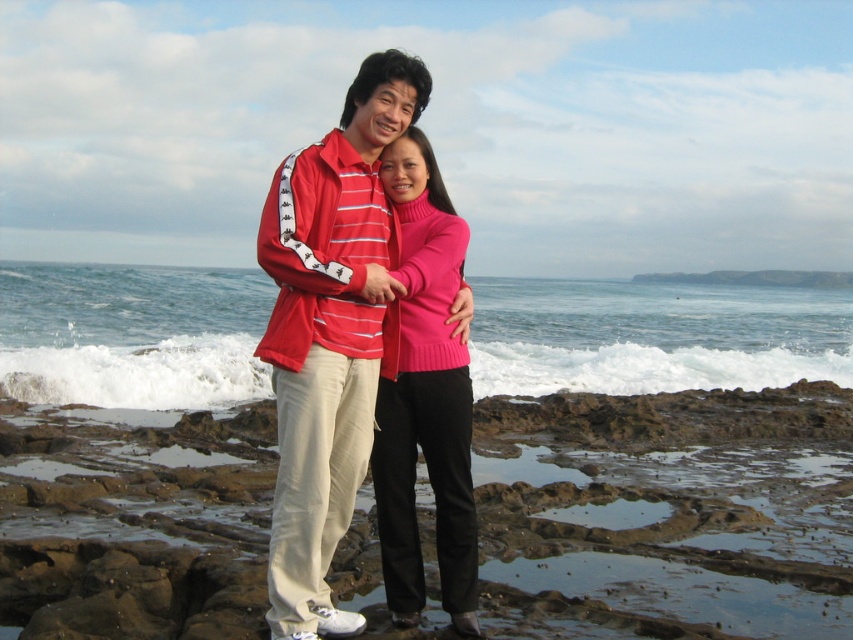
Question: Can you confirm if matte red jacket at center is positioned below matte pink sweater at center?

Choices:
 (A) no
 (B) yes

Answer: (A)

Question: Estimate the real-world distances between objects in this image. Which object is closer to the matte red jacket at center?

Choices:
 (A) matte pink sweater at center
 (B) brown rocky coast at center

Answer: (A)

Question: Is brown rocky coast at center positioned at the back of matte red jacket at center?

Choices:
 (A) yes
 (B) no

Answer: (A)

Question: Which point is farther from the camera taking this photo?

Choices:
 (A) (296, 250)
 (B) (689, 580)
 (C) (473, 609)

Answer: (B)

Question: Does matte red jacket at center appear on the right side of matte pink sweater at center?

Choices:
 (A) yes
 (B) no

Answer: (B)

Question: Which object is positioned closest to the matte red jacket at center?

Choices:
 (A) matte pink sweater at center
 (B) brown rocky coast at center

Answer: (A)